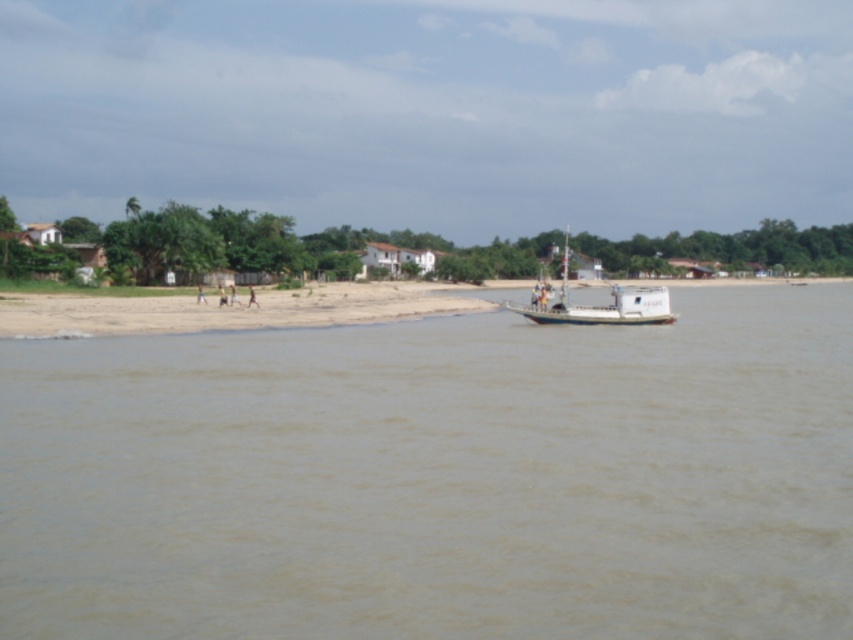
Question: Which object is farther from the camera taking this photo?

Choices:
 (A) white matte boat at center
 (B) brown muddy water at center

Answer: (A)

Question: Is the position of brown muddy water at center more distant than that of white matte boat at center?

Choices:
 (A) no
 (B) yes

Answer: (A)

Question: Among these points, which one is nearest to the camera?

Choices:
 (A) (648, 307)
 (B) (505, 500)

Answer: (B)

Question: Can you confirm if brown muddy water at center is positioned below white matte boat at center?

Choices:
 (A) no
 (B) yes

Answer: (B)

Question: Which object is farther from the camera taking this photo?

Choices:
 (A) brown muddy water at center
 (B) white matte boat at center

Answer: (B)

Question: Considering the relative positions of brown muddy water at center and white matte boat at center in the image provided, where is brown muddy water at center located with respect to white matte boat at center?

Choices:
 (A) above
 (B) below

Answer: (B)